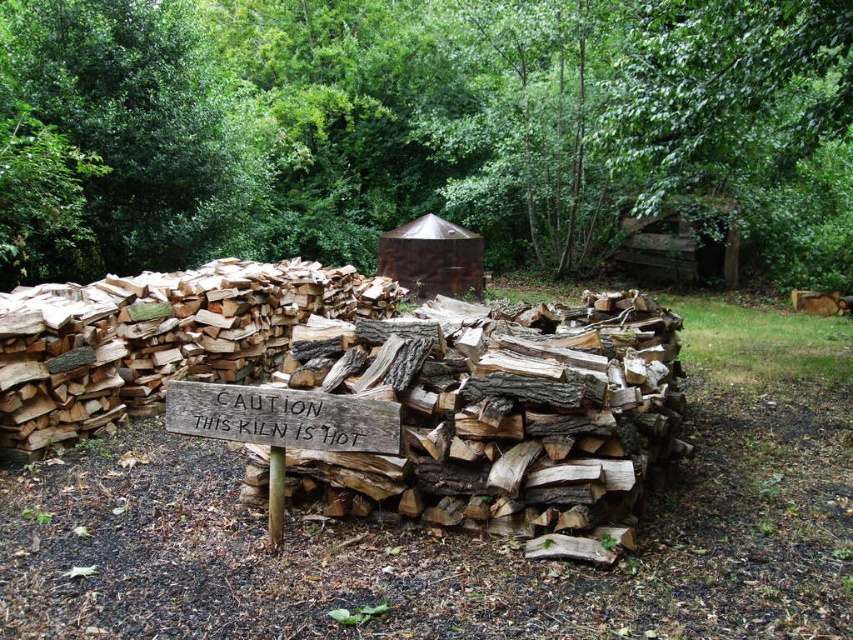
Is green leafy tree at upper center above weathered wood sign at center?

Yes, green leafy tree at upper center is above weathered wood sign at center.

Is green leafy tree at upper center taller than weathered wood sign at center?

Indeed, green leafy tree at upper center has a greater height compared to weathered wood sign at center.

Where is `green leafy tree at upper center`? Image resolution: width=853 pixels, height=640 pixels. green leafy tree at upper center is located at coordinates (421, 129).

Image resolution: width=853 pixels, height=640 pixels. What are the coordinates of `green leafy tree at upper center` in the screenshot? It's located at (421, 129).